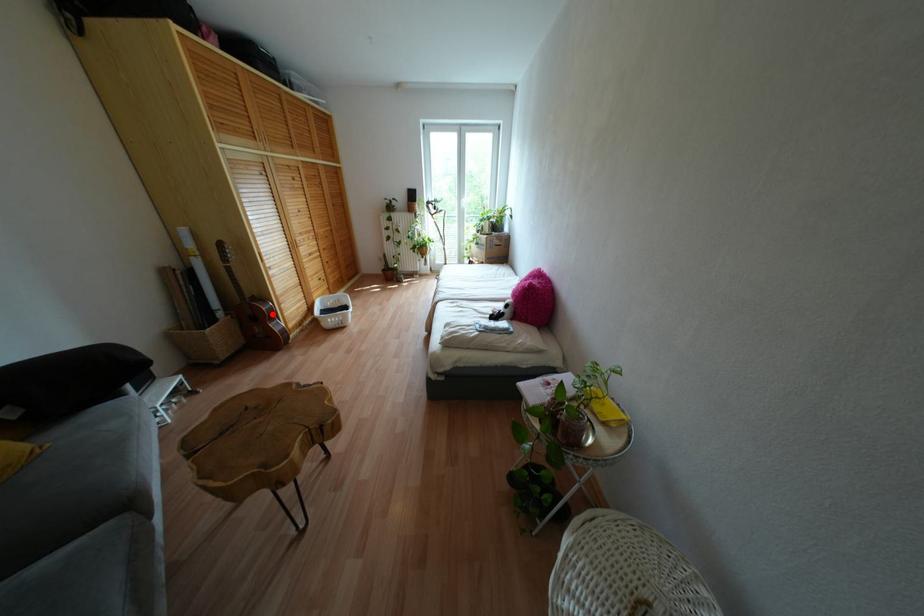
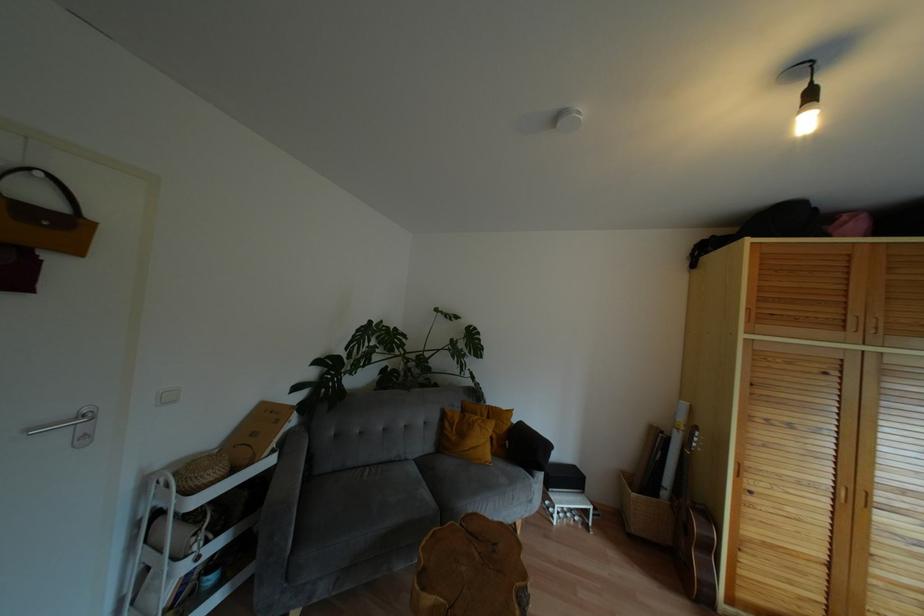
Question: I am providing you with two images of the same scene from different viewpoints. A red point is shown in image1. For the corresponding object point in image2, is it positioned nearer or farther from the camera?

Choices:
 (A) Nearer
 (B) Farther

Answer: (B)